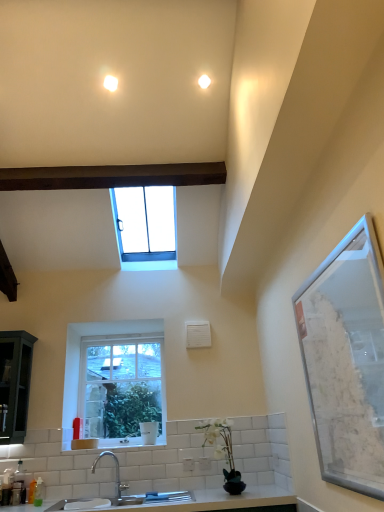
Question: Which direction should I rotate to face clear glass window at upper center, marked as the 2th window in a bottom-to-top arrangement, — up or down?

Choices:
 (A) up
 (B) down

Answer: (A)

Question: Considering the relative sizes of clear glass window at upper center, placed as the 1th window when sorted from top to bottom, and clear glass window at center, which is the 2th window in top-to-bottom order, in the image provided, is clear glass window at upper center, placed as the 1th window when sorted from top to bottom, thinner than clear glass window at center, which is the 2th window in top-to-bottom order,?

Choices:
 (A) no
 (B) yes

Answer: (A)

Question: Would you say clear glass window at upper center, marked as the 2th window in a bottom-to-top arrangement, is outside clear glass window at center, the 1th window in the bottom-to-top sequence?

Choices:
 (A) no
 (B) yes

Answer: (B)

Question: Does clear glass window at upper center, placed as the 1th window when sorted from top to bottom, have a greater height compared to clear glass window at center, the 1th window in the bottom-to-top sequence?

Choices:
 (A) yes
 (B) no

Answer: (B)

Question: From a real-world perspective, does clear glass window at upper center, marked as the 2th window in a bottom-to-top arrangement, sit lower than clear glass window at center, which is the 2th window in top-to-bottom order?

Choices:
 (A) no
 (B) yes

Answer: (A)

Question: Is clear glass window at upper center, placed as the 1th window when sorted from top to bottom, positioned before clear glass window at center, the 1th window in the bottom-to-top sequence?

Choices:
 (A) no
 (B) yes

Answer: (B)

Question: Is clear glass window at center, the 1th window in the bottom-to-top sequence, at the back of clear glass window at upper center, placed as the 1th window when sorted from top to bottom?

Choices:
 (A) no
 (B) yes

Answer: (A)

Question: Would you say white matte vase at lower center is outside white ceramic sink at lower center?

Choices:
 (A) yes
 (B) no

Answer: (A)

Question: Can you confirm if white matte vase at lower center is taller than white ceramic sink at lower center?

Choices:
 (A) no
 (B) yes

Answer: (B)

Question: Is the surface of white matte vase at lower center in direct contact with white ceramic sink at lower center?

Choices:
 (A) yes
 (B) no

Answer: (B)

Question: Does white matte vase at lower center have a lesser height compared to white ceramic sink at lower center?

Choices:
 (A) no
 (B) yes

Answer: (A)

Question: Is white matte vase at lower center aimed at white ceramic sink at lower center?

Choices:
 (A) no
 (B) yes

Answer: (A)

Question: Is white matte vase at lower center to the right of white ceramic sink at lower center from the viewer's perspective?

Choices:
 (A) yes
 (B) no

Answer: (A)

Question: Does satin nickel faucet at lower center have a smaller size compared to clear glass window at center, which is the 2th window in top-to-bottom order?

Choices:
 (A) no
 (B) yes

Answer: (A)